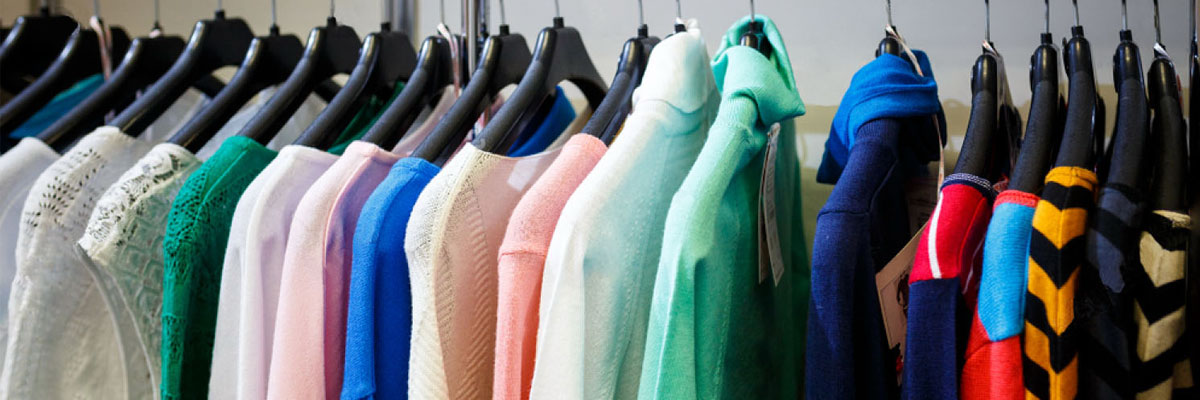
Locate an element on the screen. This screenshot has height=400, width=1200. white wall is located at coordinates (844, 46).